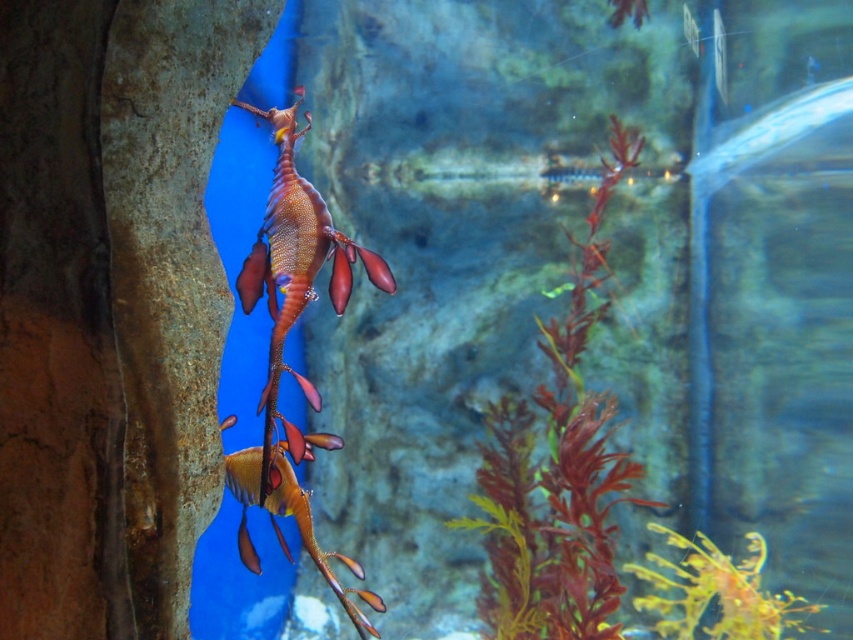
Can you confirm if translucent glass water at center is taller than reddish-brown leafy plant at center-right?

Yes.

Is translucent glass water at center bigger than reddish-brown leafy plant at center-right?

Correct, translucent glass water at center is larger in size than reddish-brown leafy plant at center-right.

Does point (502, 339) lie behind point (583, 285)?

Yes, it is behind point (583, 285).

Identify the location of translucent glass water at center. The image size is (853, 640). (572, 266).